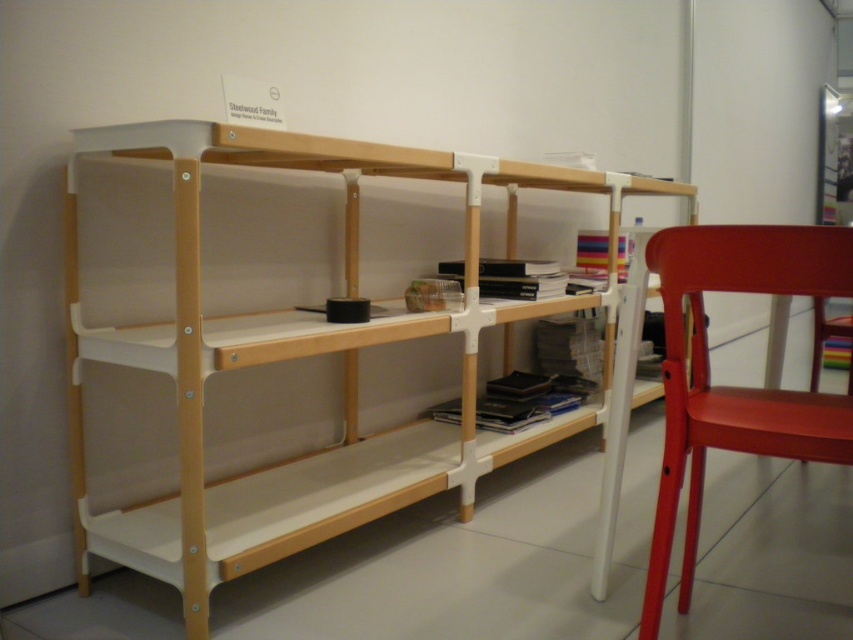
Question: Does white matte bookshelf at center have a smaller size compared to matte red chair at right?

Choices:
 (A) yes
 (B) no

Answer: (B)

Question: Which point is closer to the camera?

Choices:
 (A) (335, 532)
 (B) (664, 252)

Answer: (B)

Question: Does white matte bookshelf at center appear on the left side of matte red chair at right?

Choices:
 (A) yes
 (B) no

Answer: (A)

Question: Is white matte bookshelf at center thinner than matte red chair at right?

Choices:
 (A) yes
 (B) no

Answer: (B)

Question: Which point is farther to the camera?

Choices:
 (A) (822, 260)
 (B) (355, 225)

Answer: (B)